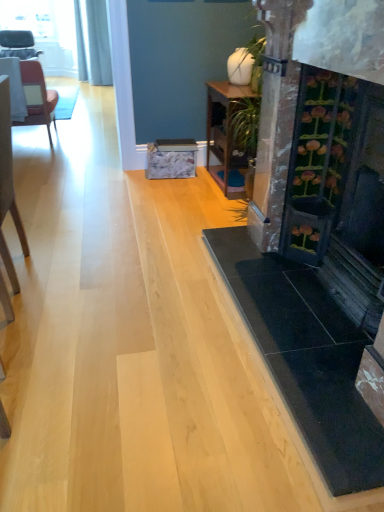
Identify the location of free space to the left of dark wood fireplace at right. (130, 326).